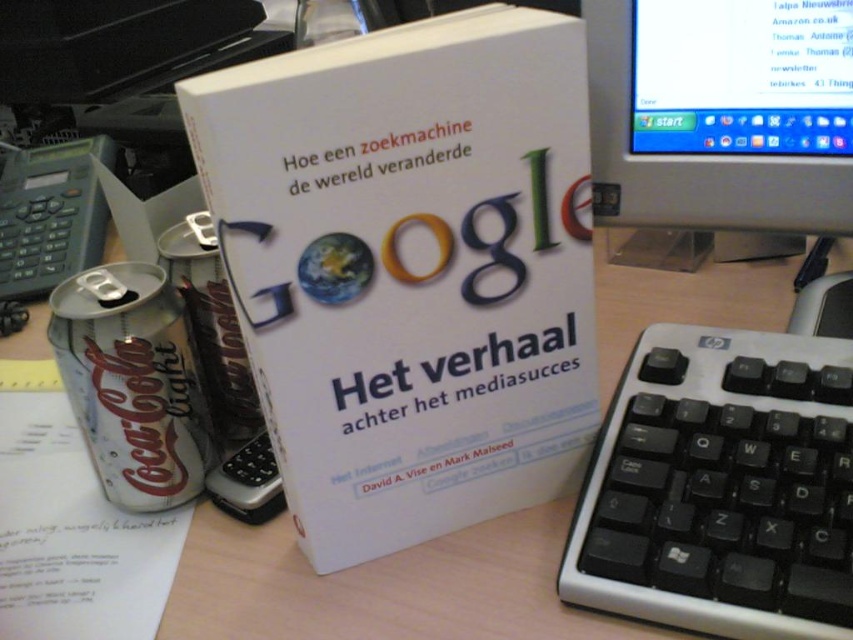
You are organizing a bookshelf and need to know if the white paper book at center can fit vertically behind the matte plastic monitor at upper right. Based on their heights, can it fit?

The white paper book at center is taller than the matte plastic monitor at upper right. Since the book is taller, it cannot fit vertically behind the monitor as it would exceed the monitor height.

From the picture: You are a photographer trying to capture the white paper book at center in a closeup shot. If your camera lens can only focus on objects within a 0.45 meter radius from the center point, will the book be in focus?

The white paper book at center is located at point (409, 269), which is within the 0.45 meter radius, so it will be in focus.

You are organizing a desk and need to decide whether the white paper book at center can be placed on top of the matte plastic monitor at upper right. Based on their sizes, can the book fit on the monitor?

The white paper book at center is larger in size than matte plastic monitor at upper right, so it cannot fit on top of the monitor.